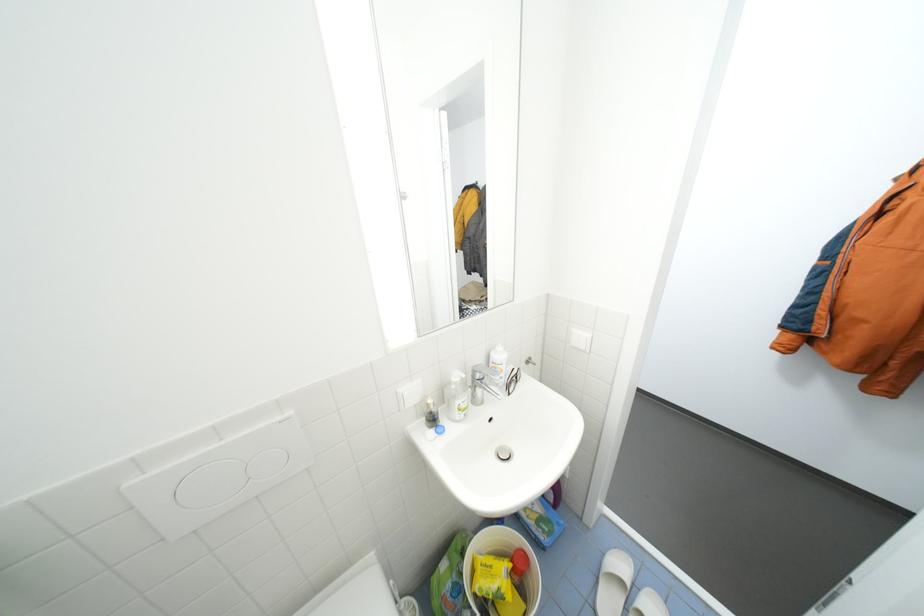
The location [518,562] corresponds to which object?

It refers to a red bottle cap.